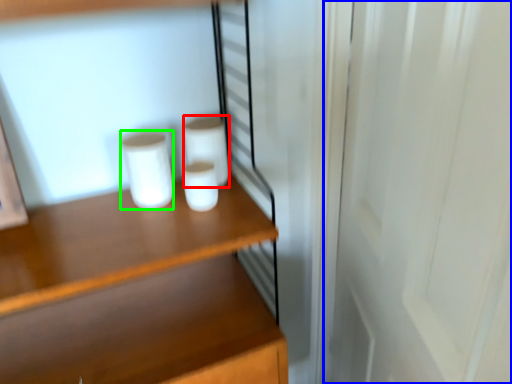
Question: Which is nearer to the paper towel (highlighted by a red box)? screen door (highlighted by a blue box) or paper towel (highlighted by a green box).

Choices:
 (A) screen door
 (B) paper towel

Answer: (B)